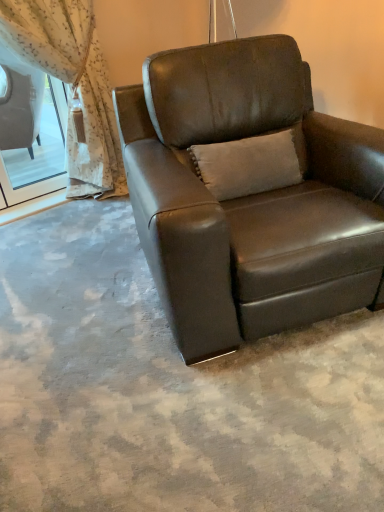
You are a GUI agent. You are given a task and a screenshot of the screen. Output one action in this format:
    pyautogui.click(x=<x>, y=<y>)
    Task: Click on the suede beige pillow at center
    This screenshot has width=384, height=512.
    Given the screenshot: What is the action you would take?
    pyautogui.click(x=251, y=163)

The width and height of the screenshot is (384, 512). Describe the element at coordinates (72, 84) in the screenshot. I see `sheer floral fabric at upper left` at that location.

Identify the location of suede beige pillow at center. (251, 163).

From a real-world perspective, which is physically above, brown leather chair at center or suede beige pillow at center?

From a 3D spatial view, suede beige pillow at center is above.

Considering the positions of points (163, 280) and (280, 144), is point (163, 280) farther from camera compared to point (280, 144)?

No, (163, 280) is in front of (280, 144).

From the picture: Is brown leather chair at center taller or shorter than suede beige pillow at center?

Clearly, brown leather chair at center is taller compared to suede beige pillow at center.

Is brown leather chair at center bigger than suede beige pillow at center?

Indeed, brown leather chair at center has a larger size compared to suede beige pillow at center.

Is sheer floral fabric at upper left turned away from suede beige pillow at center?

No, sheer floral fabric at upper left is not facing away from suede beige pillow at center.

Are sheer floral fabric at upper left and suede beige pillow at center located far from each other?

Yes, sheer floral fabric at upper left is far from suede beige pillow at center.

Locate an element on the screen. The width and height of the screenshot is (384, 512). pillow on the right of sheer floral fabric at upper left is located at coordinates (251, 163).

From the image's perspective, relative to suede beige pillow at center, is sheer floral fabric at upper left above or below?

Based on their image positions, sheer floral fabric at upper left is located above suede beige pillow at center.

From the image's perspective, which is below, suede beige pillow at center or sheer floral fabric at upper left?

suede beige pillow at center appears lower in the image.

Is suede beige pillow at center far away from sheer floral fabric at upper left?

Indeed, suede beige pillow at center is not near sheer floral fabric at upper left.

Is suede beige pillow at center wider than sheer floral fabric at upper left?

No, suede beige pillow at center is not wider than sheer floral fabric at upper left.

Is suede beige pillow at center oriented away from brown leather chair at center?

Yes, suede beige pillow at center's orientation is away from brown leather chair at center.

In terms of height, does suede beige pillow at center look taller or shorter compared to brown leather chair at center?

suede beige pillow at center is shorter than brown leather chair at center.

Is suede beige pillow at center not near brown leather chair at center?

No.

Is suede beige pillow at center to the left of brown leather chair at center from the viewer's perspective?

Yes.

Considering the sizes of brown leather chair at center and sheer floral fabric at upper left in the image, is brown leather chair at center wider or thinner than sheer floral fabric at upper left?

In the image, brown leather chair at center appears to be wider than sheer floral fabric at upper left.

From the image's perspective, who appears lower, brown leather chair at center or sheer floral fabric at upper left?

brown leather chair at center.

Is brown leather chair at center positioned with its back to sheer floral fabric at upper left?

That's right, brown leather chair at center is facing away from sheer floral fabric at upper left.

Is the depth of sheer floral fabric at upper left greater than that of brown leather chair at center?

Yes, the depth of sheer floral fabric at upper left is greater than that of brown leather chair at center.

Is point (118, 179) farther from viewer compared to point (343, 233)?

Yes, point (118, 179) is farther from viewer.

Locate an element on the screen. This screenshot has width=384, height=512. curtain that appears above the brown leather chair at center (from the image's perspective) is located at coordinates (72, 84).

Considering the sizes of objects sheer floral fabric at upper left and brown leather chair at center in the image provided, who is wider, sheer floral fabric at upper left or brown leather chair at center?

brown leather chair at center is wider.

Locate an element on the screen. The width and height of the screenshot is (384, 512). pillow that appears behind the brown leather chair at center is located at coordinates (251, 163).

Locate an element on the screen. This screenshot has width=384, height=512. curtain on the left of the suede beige pillow at center is located at coordinates coord(72,84).

Considering their positions, is sheer floral fabric at upper left positioned closer to brown leather chair at center than suede beige pillow at center?

The object closer to brown leather chair at center is suede beige pillow at center.

Looking at the image, which one is located further to brown leather chair at center, suede beige pillow at center or sheer floral fabric at upper left?

sheer floral fabric at upper left lies further to brown leather chair at center than the other object.

Estimate the real-world distances between objects in this image. Which object is closer to sheer floral fabric at upper left, suede beige pillow at center or brown leather chair at center?

brown leather chair at center lies closer to sheer floral fabric at upper left than the other object.

When comparing their distances from sheer floral fabric at upper left, does brown leather chair at center or suede beige pillow at center seem closer?

→ brown leather chair at center.

Looking at the image, which one is located further to suede beige pillow at center, brown leather chair at center or sheer floral fabric at upper left?

Based on the image, sheer floral fabric at upper left appears to be further to suede beige pillow at center.

From the image, which object appears to be farther from suede beige pillow at center, sheer floral fabric at upper left or brown leather chair at center?

The object further to suede beige pillow at center is sheer floral fabric at upper left.

I want to click on pillow between sheer floral fabric at upper left and brown leather chair at center in the horizontal direction, so point(251,163).